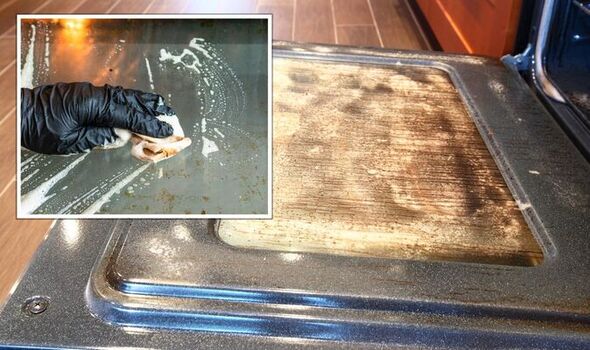
Find the location of a particular element. The width and height of the screenshot is (590, 350). floor is located at coordinates (319, 15), (16, 247).